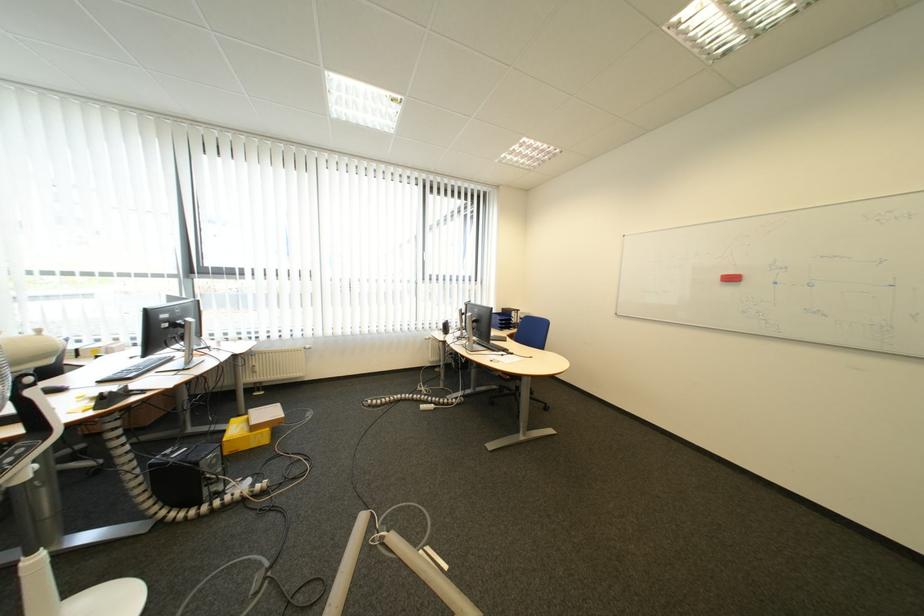
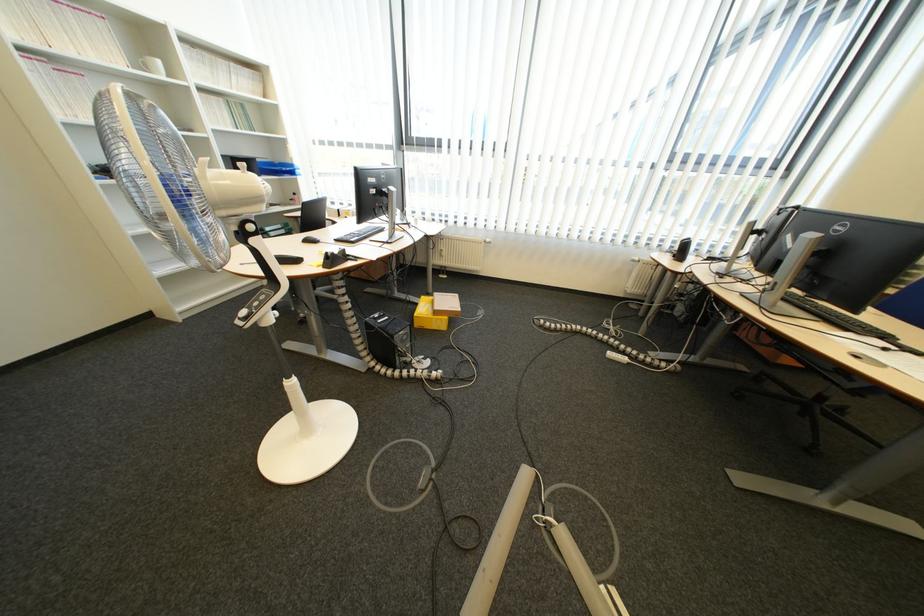
Locate, in the second image, the point that corresponds to point (268, 373) in the first image.

(455, 257)